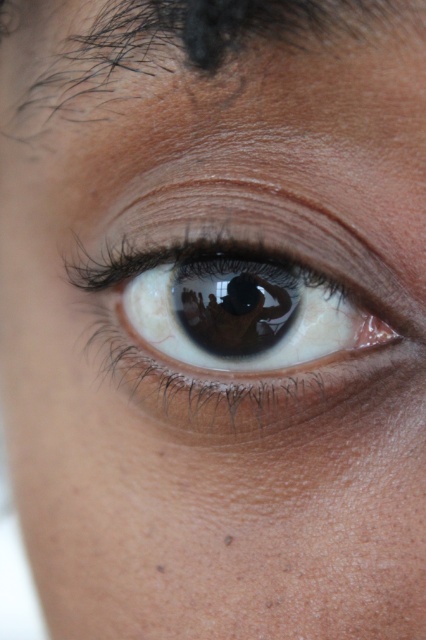
You are a photographer trying to capture a detailed closeup of the brown glossy eye at center. According to the coordinates provided, where exactly should you focus your camera lens to ensure the eye is in sharp focus?

To ensure the brown glossy eye at center is in sharp focus, you should focus your camera lens precisely at the coordinates point (244, 310), as that is the exact location of the brown glossy eye at center.